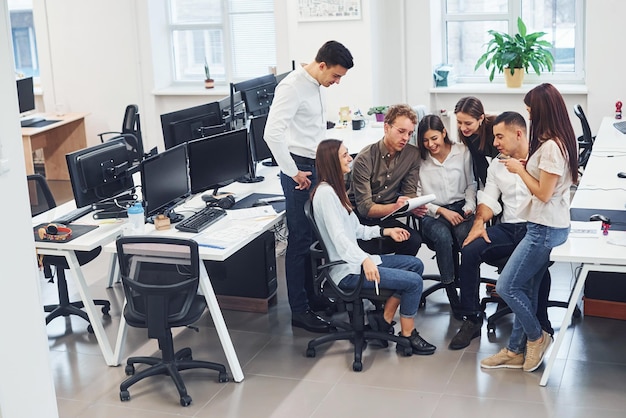
You are a GUI agent. You are given a task and a screenshot of the screen. Output one action in this format:
    pyautogui.click(x=<x>, y=<y>)
    Task: Click on the chairs
    The image size is (626, 418).
    Given the screenshot: What is the action you would take?
    pyautogui.click(x=173, y=311), pyautogui.click(x=61, y=296), pyautogui.click(x=135, y=124), pyautogui.click(x=354, y=298), pyautogui.click(x=411, y=210), pyautogui.click(x=433, y=270), pyautogui.click(x=498, y=278)